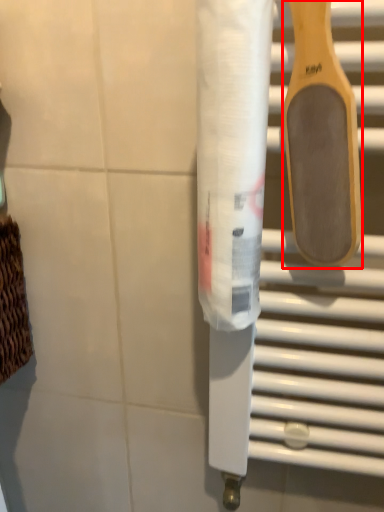
Question: Observing the image, what is the correct spatial positioning of spatula (annotated by the red box) in reference to toilet paper?

Choices:
 (A) right
 (B) left

Answer: (A)